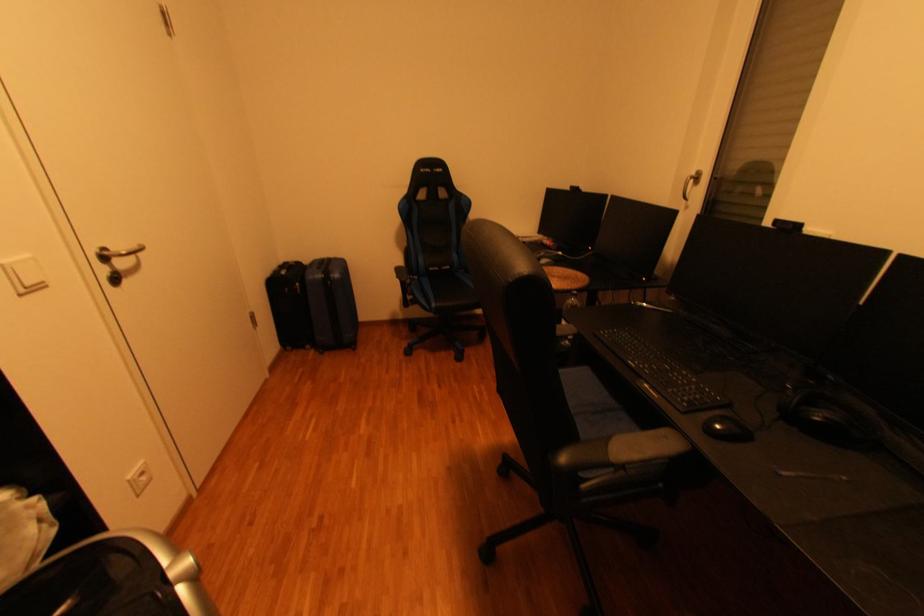
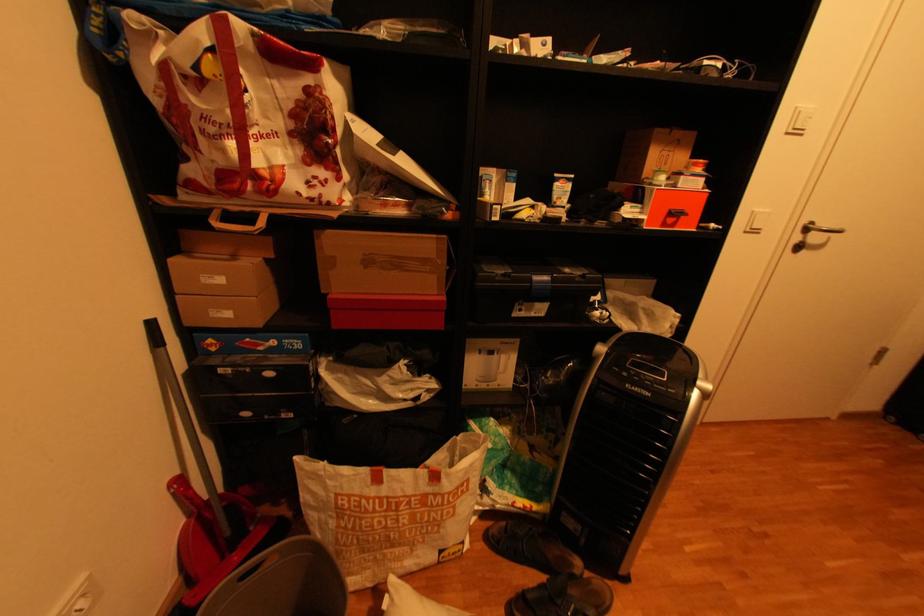
The first image is from the beginning of the video and the second image is from the end. How did the camera likely rotate when shooting the video?

The camera's rotation is toward left-down.